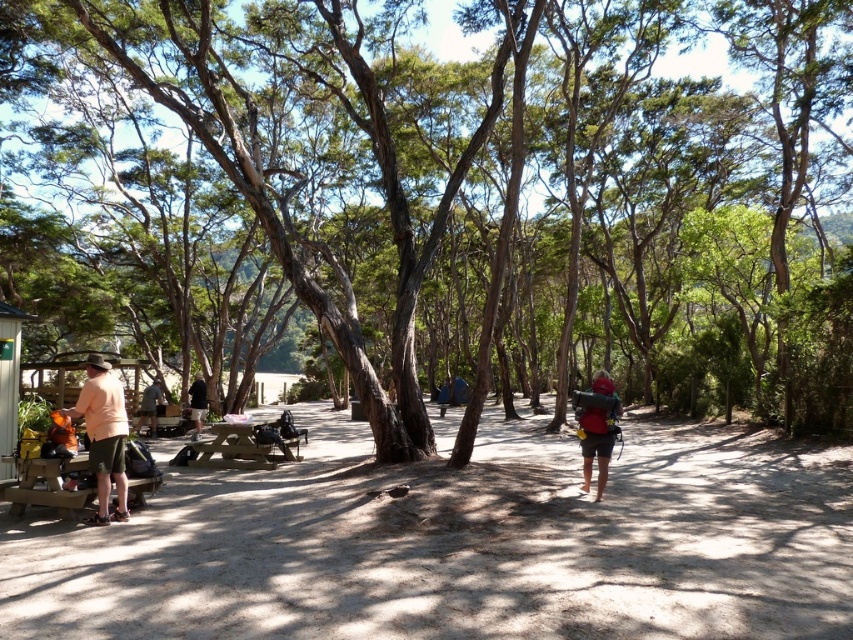
Is point (117, 472) positioned in front of point (234, 440)?

Yes.

Which is below, matte orange shirt at left or wooden picnic table at center?

wooden picnic table at center is below.

Locate an element on the screen. matte orange shirt at left is located at coordinates (103, 435).

Where is `matte orange shirt at left`? matte orange shirt at left is located at coordinates (103, 435).

Does matte orange shirt at left lie behind brown wooden bench at lower left?

No, it is in front of brown wooden bench at lower left.

Find the location of `matte orange shirt at left`. matte orange shirt at left is located at coordinates (103, 435).

Between brown textured tree at center and dark brown leather backpack at center, which one has more height?

With more height is brown textured tree at center.

Does point (39, 51) lie behind point (190, 388)?

Yes.

I want to click on brown textured tree at center, so click(492, 177).